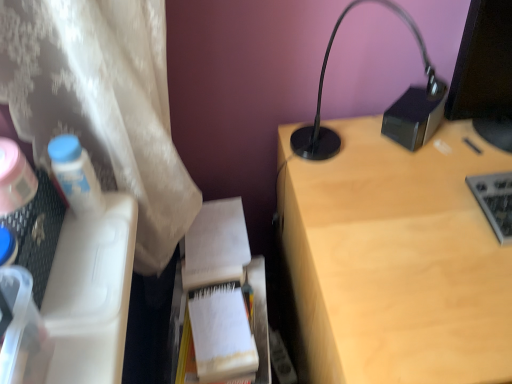
Question: Should I look upward or downward to see white paper at center?

Choices:
 (A) up
 (B) down

Answer: (B)

Question: Is white paper notebook at center positioned in front of black glossy monitor at upper right?

Choices:
 (A) yes
 (B) no

Answer: (B)

Question: From the image's perspective, does white paper notebook at center appear higher than black glossy monitor at upper right?

Choices:
 (A) yes
 (B) no

Answer: (B)

Question: Does white paper notebook at center appear on the left side of black glossy monitor at upper right?

Choices:
 (A) yes
 (B) no

Answer: (A)

Question: Does white paper notebook at center have a smaller size compared to black glossy monitor at upper right?

Choices:
 (A) yes
 (B) no

Answer: (A)

Question: Is white paper notebook at center looking in the opposite direction of black glossy monitor at upper right?

Choices:
 (A) no
 (B) yes

Answer: (A)

Question: Would you say white paper notebook at center is outside black glossy monitor at upper right?

Choices:
 (A) yes
 (B) no

Answer: (A)

Question: Is the depth of black glossy monitor at upper right greater than that of white paper at center?

Choices:
 (A) no
 (B) yes

Answer: (A)

Question: From a real-world perspective, is black glossy monitor at upper right positioned over white paper at center based on gravity?

Choices:
 (A) yes
 (B) no

Answer: (A)

Question: From the image's perspective, would you say black glossy monitor at upper right is positioned over white paper at center?

Choices:
 (A) yes
 (B) no

Answer: (A)

Question: Considering the relative sizes of black glossy monitor at upper right and white paper at center in the image provided, is black glossy monitor at upper right taller than white paper at center?

Choices:
 (A) no
 (B) yes

Answer: (B)

Question: Can you confirm if black glossy monitor at upper right is smaller than white paper at center?

Choices:
 (A) no
 (B) yes

Answer: (A)

Question: Is black glossy monitor at upper right far away from white paper at center?

Choices:
 (A) no
 (B) yes

Answer: (A)

Question: Can you confirm if light wood desk at upper right is smaller than gray metallic keyboard at right?

Choices:
 (A) no
 (B) yes

Answer: (A)